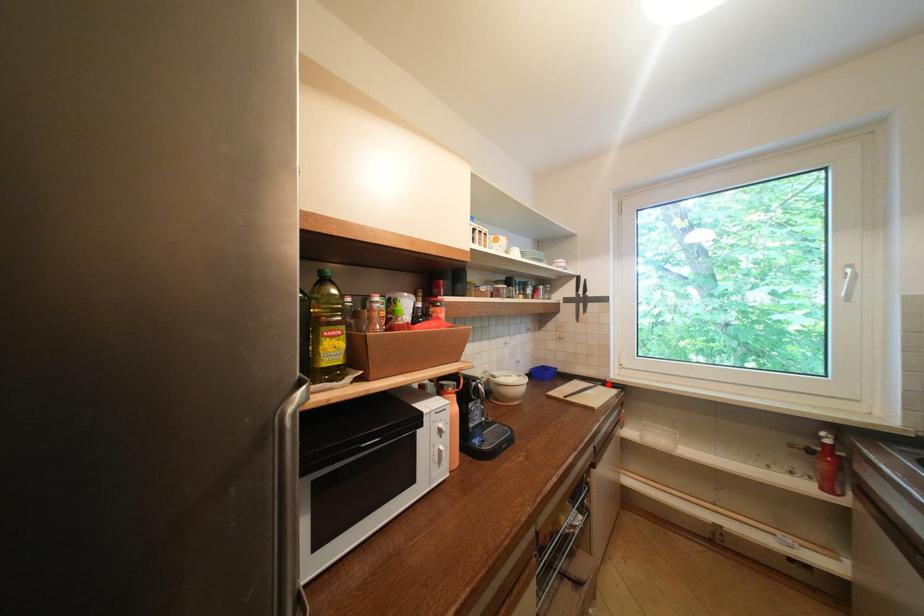
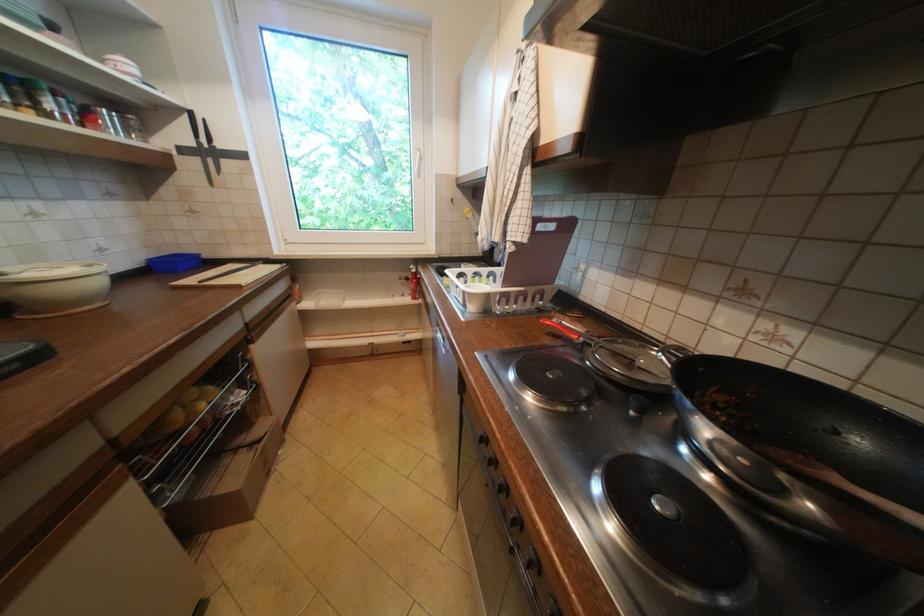
Where in the second image is the point corresponding to the highlighted location from the first image?

(270, 262)